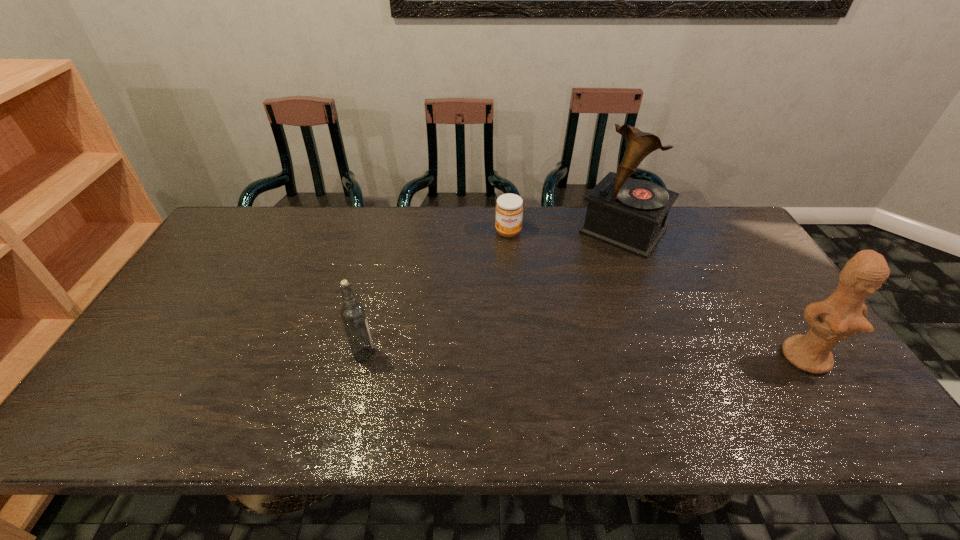
Image resolution: width=960 pixels, height=540 pixels. I want to click on free spot on the desktop that is between the third tallest object and the figurine and is positioned on the front label of the shortest object, so click(x=526, y=355).

You are a GUI agent. You are given a task and a screenshot of the screen. Output one action in this format:
    pyautogui.click(x=<x>, y=<y>)
    Task: Click on the free space on the desktop that is between the vodka and the figurine and is positioned at the horn opening of the phonograph_record
    This screenshot has height=540, width=960.
    Given the screenshot: What is the action you would take?
    pyautogui.click(x=524, y=355)